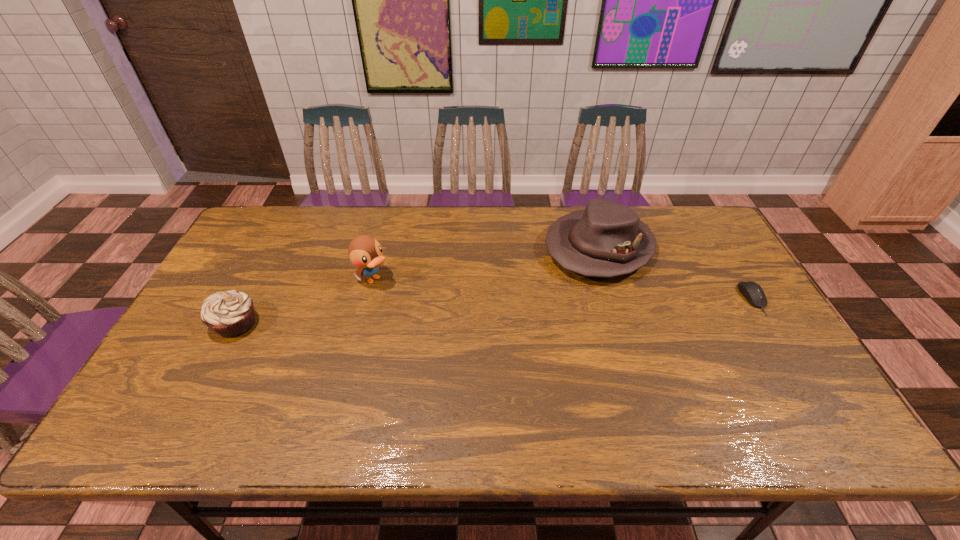
I want to click on vacant area situated on the decorative side of the third object from left to right, so click(x=518, y=312).

The height and width of the screenshot is (540, 960). In order to click on vacant region located on the front-facing side of the third object from right to left in this screenshot , I will do `click(447, 329)`.

Locate an element on the screen. vacant position located on the front-facing side of the third object from right to left is located at coordinates (417, 308).

Identify the location of free space located on the front-facing side of the third object from right to left. The image size is (960, 540). (424, 313).

Find the location of `object located in the far edge section of the desktop`. object located in the far edge section of the desktop is located at coordinates (607, 239).

This screenshot has height=540, width=960. Find the location of `object that is at the left edge`. object that is at the left edge is located at coordinates (230, 314).

In order to click on object situated at the right edge in this screenshot , I will do tap(754, 294).

Locate an element on the screen. The height and width of the screenshot is (540, 960). vacant position at the far edge of the desktop is located at coordinates (458, 235).

This screenshot has width=960, height=540. I want to click on vacant region at the near edge of the desktop, so pyautogui.click(x=359, y=390).

Where is `vacant region at the right edge of the desktop`? The width and height of the screenshot is (960, 540). vacant region at the right edge of the desktop is located at coordinates (755, 311).